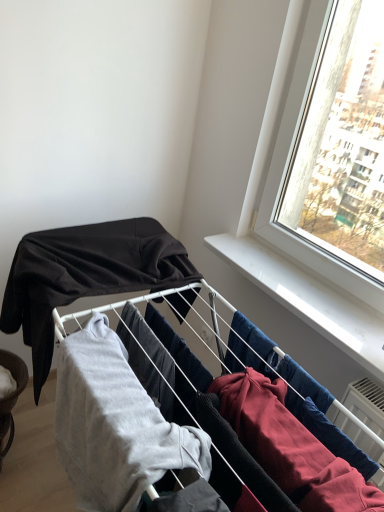
Question: Which direction should I rotate to look at light gray cotton sweatshirt at center, which is the 1th clothing from front to back?

Choices:
 (A) left
 (B) right

Answer: (A)

Question: Is brushed metal bowl at lower left completely or partially outside of matte black fabric at upper left, the 2th clothing viewed from the front?

Choices:
 (A) no
 (B) yes

Answer: (B)

Question: Would you say matte black fabric at upper left, acting as the 1th clothing starting from the back, is part of brushed metal bowl at lower left's contents?

Choices:
 (A) no
 (B) yes

Answer: (A)

Question: From the image's perspective, does brushed metal bowl at lower left appear higher than matte black fabric at upper left, the 2th clothing viewed from the front?

Choices:
 (A) no
 (B) yes

Answer: (A)

Question: Is brushed metal bowl at lower left not near matte black fabric at upper left, acting as the 1th clothing starting from the back?

Choices:
 (A) yes
 (B) no

Answer: (B)

Question: Can you confirm if brushed metal bowl at lower left is wider than matte black fabric at upper left, the 2th clothing viewed from the front?

Choices:
 (A) no
 (B) yes

Answer: (A)

Question: Does brushed metal bowl at lower left have a smaller size compared to matte black fabric at upper left, the 2th clothing viewed from the front?

Choices:
 (A) no
 (B) yes

Answer: (B)

Question: Can you confirm if light gray cotton sweatshirt at center, which is the 1th clothing from front to back, is thinner than matte black fabric at upper left, the 2th clothing viewed from the front?

Choices:
 (A) yes
 (B) no

Answer: (A)

Question: Is light gray cotton sweatshirt at center, the 2th clothing viewed from the back, facing towards matte black fabric at upper left, acting as the 1th clothing starting from the back?

Choices:
 (A) no
 (B) yes

Answer: (A)

Question: Can you confirm if light gray cotton sweatshirt at center, the 2th clothing viewed from the back, is taller than matte black fabric at upper left, acting as the 1th clothing starting from the back?

Choices:
 (A) yes
 (B) no

Answer: (A)

Question: Is matte black fabric at upper left, the 2th clothing viewed from the front, completely or partially inside light gray cotton sweatshirt at center, which is the 1th clothing from front to back?

Choices:
 (A) no
 (B) yes

Answer: (A)

Question: From the image's perspective, is light gray cotton sweatshirt at center, which is the 1th clothing from front to back, above matte black fabric at upper left, acting as the 1th clothing starting from the back?

Choices:
 (A) yes
 (B) no

Answer: (B)

Question: From a real-world perspective, is light gray cotton sweatshirt at center, which is the 1th clothing from front to back, physically below matte black fabric at upper left, acting as the 1th clothing starting from the back?

Choices:
 (A) yes
 (B) no

Answer: (A)

Question: Is matte black fabric at upper left, acting as the 1th clothing starting from the back, positioned with its back to light gray cotton sweatshirt at center, which is the 1th clothing from front to back?

Choices:
 (A) no
 (B) yes

Answer: (A)